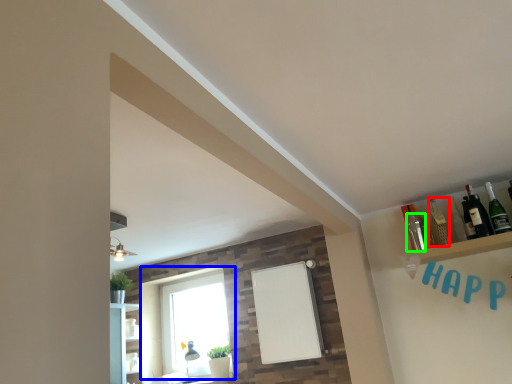
Question: Which object is the farthest from bottle (highlighted by a red box)? Choose among these: window (highlighted by a blue box) or bottle (highlighted by a green box).

Choices:
 (A) window
 (B) bottle

Answer: (A)